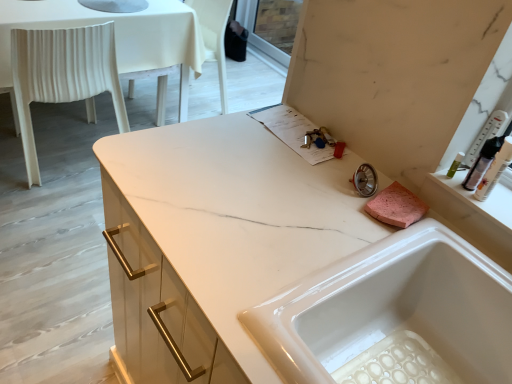
Identify the location of white glossy sink at center. (394, 315).

Identify the location of translucent plastic bottle at upper right. (494, 170).

Does white plastic chair at left lie in front of white glossy sink at center?

No.

Between point (75, 31) and point (468, 323), which one is positioned behind?

The point (75, 31) is farther.

Considering the sizes of objects white plastic chair at left and white glossy sink at center in the image provided, who is thinner, white plastic chair at left or white glossy sink at center?

white glossy sink at center is thinner.

Which is correct: white plastic chair at left is inside white glossy sink at center, or outside of it?

white plastic chair at left exists outside the volume of white glossy sink at center.

Which of these two, white glossy sink at center or white plastic chair at left, is thinner?

white glossy sink at center is thinner.

Consider the image. From a real-world perspective, is white glossy sink at center physically above white plastic chair at left?

Indeed, from a real-world perspective, white glossy sink at center stands above white plastic chair at left.

Between white glossy sink at center and white plastic chair at left, which one appears on the left side from the viewer's perspective?

Positioned to the left is white plastic chair at left.

Is white glossy sink at center facing towards white plastic chair at left?

No, white glossy sink at center is not turned towards white plastic chair at left.

Which point is more distant from viewer, (484, 182) or (102, 79)?

The point (102, 79) is farther from the camera.

Is translucent plastic bottle at upper right thinner than white plastic chair at left?

Correct, the width of translucent plastic bottle at upper right is less than that of white plastic chair at left.

Does translucent plastic bottle at upper right have a lesser height compared to white plastic chair at left?

Yes, translucent plastic bottle at upper right is shorter than white plastic chair at left.

From the image's perspective, which is below, translucent plastic bottle at upper right or white plastic chair at left?

translucent plastic bottle at upper right, from the image's perspective.

Is white plastic chair at left further to the viewer compared to translucent plastic bottle at upper right?

Yes, white plastic chair at left is further from the viewer.

Which point is more forward, (30, 61) or (487, 179)?

The point (487, 179) is closer to the camera.

The image size is (512, 384). I want to click on toiletry on the right of white plastic chair at left, so click(x=494, y=170).

From a real-world perspective, between white plastic chair at left and translucent plastic bottle at upper right, who is vertically lower?

white plastic chair at left, from a real-world perspective.

Looking at this image, is white glossy sink at center closer to the viewer compared to translucent plastic bottle at upper right?

Yes, it is in front of translucent plastic bottle at upper right.

I want to click on sink below the translucent plastic bottle at upper right (from a real-world perspective), so click(394, 315).

Is translucent plastic bottle at upper right at the back of white glossy sink at center?

No.

Which object is thinner, white glossy sink at center or translucent plastic bottle at upper right?

Thinner between the two is translucent plastic bottle at upper right.

Who is taller, translucent plastic bottle at upper right or white glossy sink at center?

white glossy sink at center is taller.

From the image's perspective, which is above, translucent plastic bottle at upper right or white glossy sink at center?

translucent plastic bottle at upper right, from the image's perspective.

Is the surface of translucent plastic bottle at upper right in direct contact with white glossy sink at center?

No, translucent plastic bottle at upper right is not touching white glossy sink at center.

Is translucent plastic bottle at upper right bigger or smaller than white glossy sink at center?

Considering their sizes, translucent plastic bottle at upper right takes up less space than white glossy sink at center.

This screenshot has width=512, height=384. Identify the location of sink lying on the right of white plastic chair at left. (394, 315).

The image size is (512, 384). I want to click on chair below the white glossy sink at center (from a real-world perspective), so click(x=63, y=76).

From the image, which object appears to be farther from white glossy sink at center, white plastic chair at left or translucent plastic bottle at upper right?

white plastic chair at left is positioned further to the anchor white glossy sink at center.

Estimate the real-world distances between objects in this image. Which object is further from translucent plastic bottle at upper right, white plastic chair at left or white glossy sink at center?

Based on the image, white plastic chair at left appears to be further to translucent plastic bottle at upper right.

Based on the photo, which object lies further to the anchor point translucent plastic bottle at upper right, white glossy sink at center or white plastic chair at left?

The object further to translucent plastic bottle at upper right is white plastic chair at left.

Which object lies nearer to the anchor point white glossy sink at center, translucent plastic bottle at upper right or white plastic chair at left?

translucent plastic bottle at upper right.

Based on their spatial positions, is white glossy sink at center or translucent plastic bottle at upper right closer to white plastic chair at left?

white glossy sink at center.

When comparing their distances from white plastic chair at left, does translucent plastic bottle at upper right or white glossy sink at center seem further?

Among the two, translucent plastic bottle at upper right is located further to white plastic chair at left.

Locate an element on the screen. sink located between white plastic chair at left and translucent plastic bottle at upper right in the left-right direction is located at coordinates (394, 315).